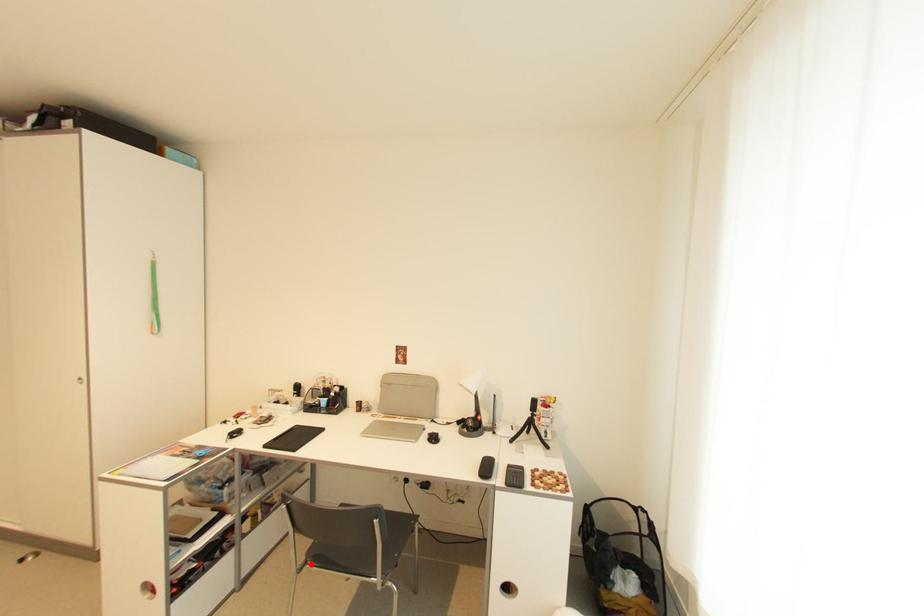
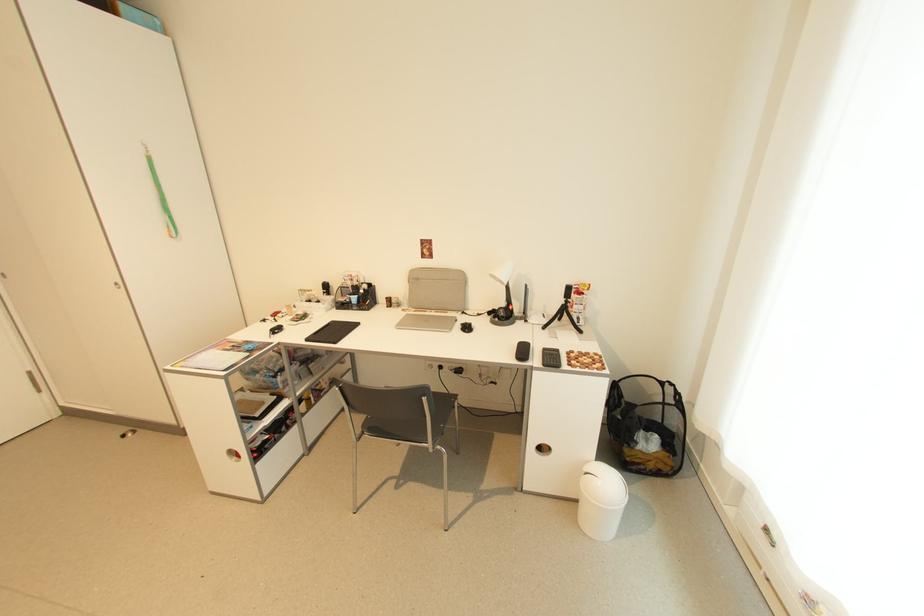
Locate, in the second image, the point that corresponds to the highlighted location in the first image.

(368, 434)